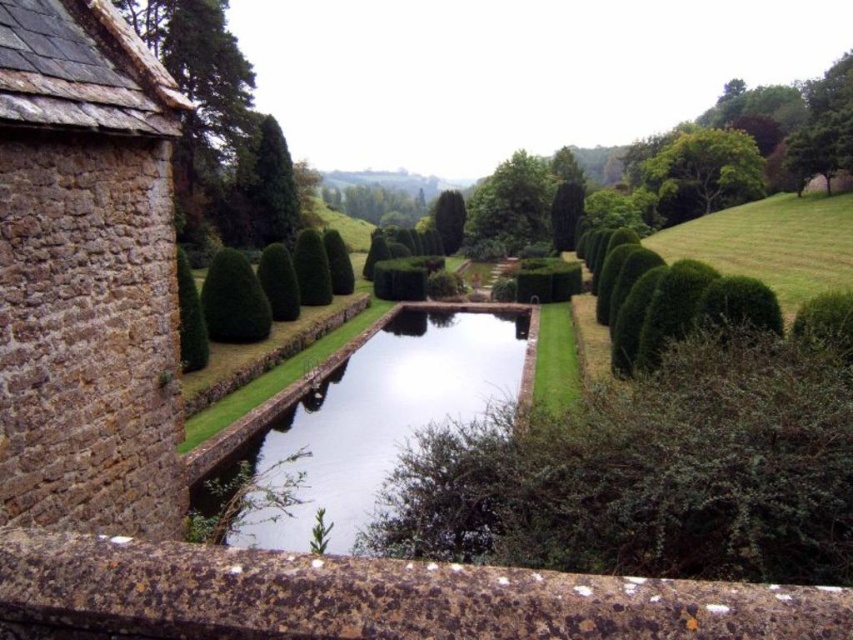
You are a landscape architect designing a new pathway through the garden. The clear water at center and the green textured hedge at center are key elements you need to consider. Given that the path must be at least 5 meters wide to accommodate visitors comfortably, will the existing space between these two features allow for this pathway?

The clear water at center and the green textured hedge at center are 7.43 meters apart. Since the required pathway width is 5 meters, the existing space of 7.43 meters is sufficient to accommodate the path comfortably.

You are standing in the garden and want to reach the point marked at coordinates (335,385). If you walk directly towards it from your current position, how far will you have to walk?

The distance between you and the point marked at coordinates (335,385) is 26.52 meters, so you will have to walk 26.52 meters to reach it.